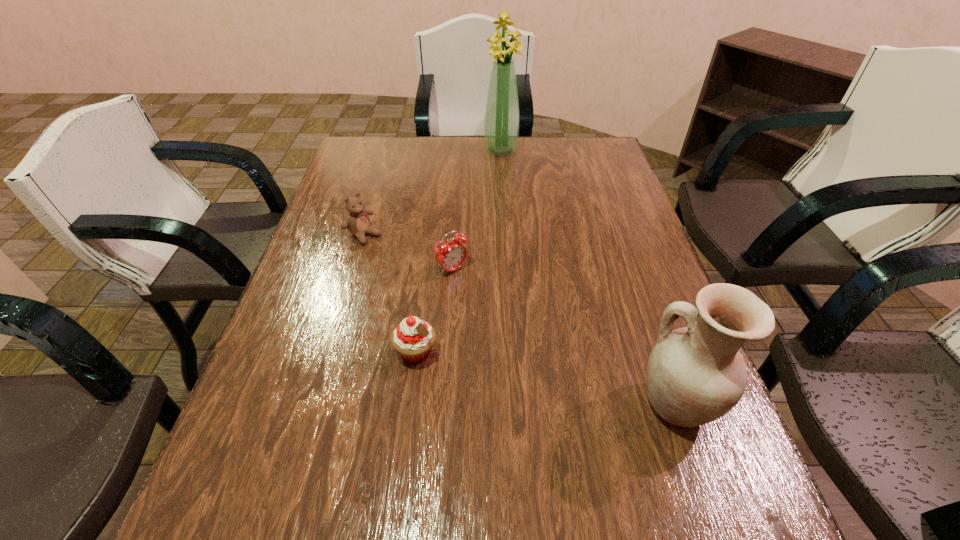
Find the location of `vacant point that satisfies the following two spatial constraints: 1. on the back side of the cupcake; 2. on the right side of the third farthest object`. vacant point that satisfies the following two spatial constraints: 1. on the back side of the cupcake; 2. on the right side of the third farthest object is located at coordinates (426, 270).

Find the location of a particular element. free space that satisfies the following two spatial constraints: 1. on the back side of the bouquet; 2. on the right side of the alarm clock is located at coordinates (460, 150).